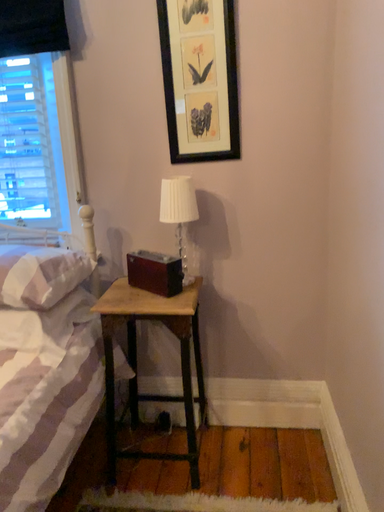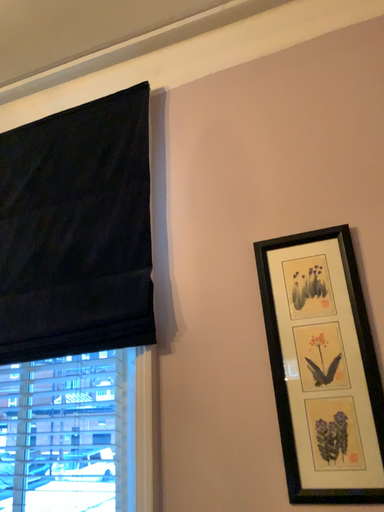
Question: Which way did the camera rotate in the video?

Choices:
 (A) rotated downward
 (B) rotated upward

Answer: (B)